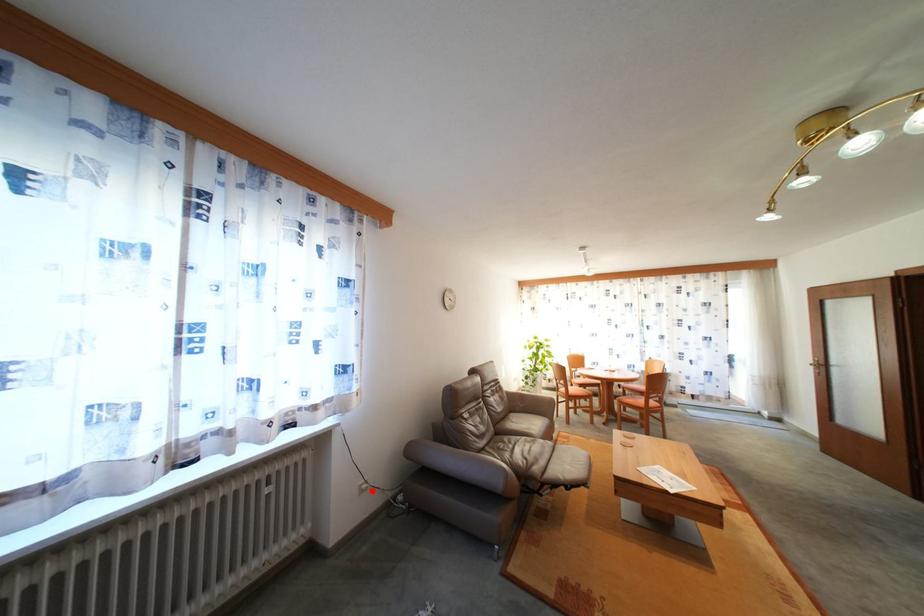
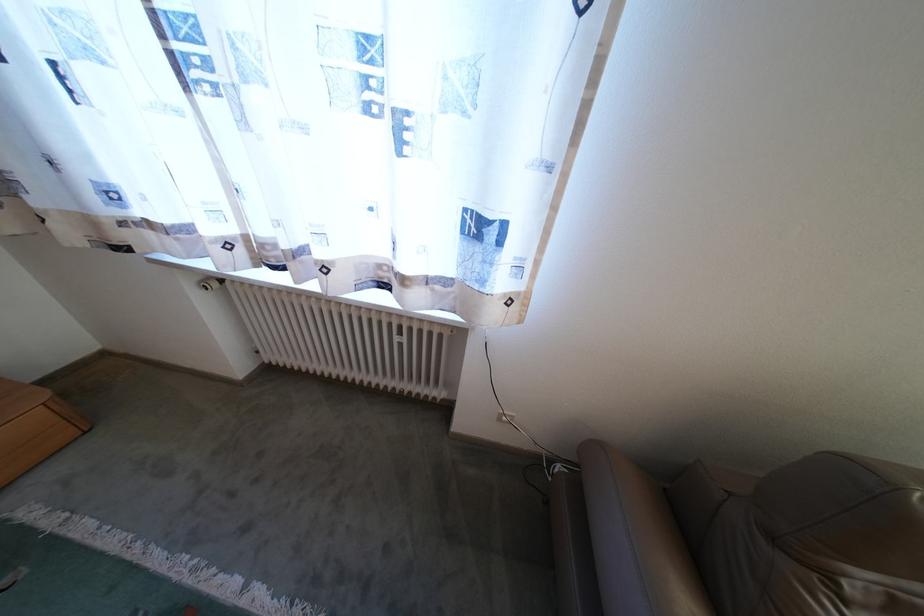
Find the pixel in the second image that matches the highlighted location in the first image.

(512, 419)